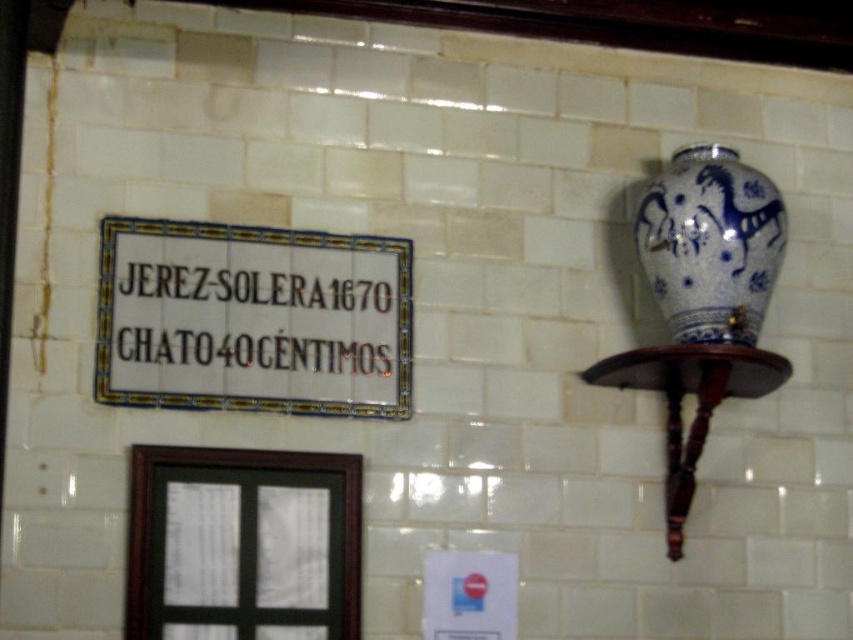
Locate an element on the screen. white ceramic sign at upper left is located at coordinates (252, 320).

Between white ceramic sign at upper left and blue and white ceramic vase at upper right, which one appears on the right side from the viewer's perspective?

From the viewer's perspective, blue and white ceramic vase at upper right appears more on the right side.

Locate an element on the screen. This screenshot has height=640, width=853. white ceramic sign at upper left is located at coordinates (252, 320).